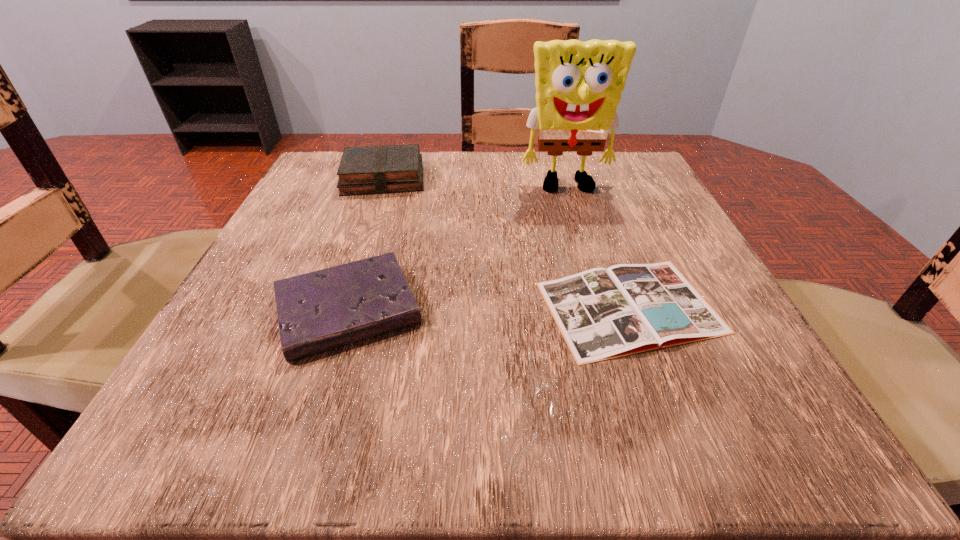
In order to click on free spot that satisfies the following two spatial constraints: 1. on the face of the tallest object; 2. on the right side of the shortest object in this screenshot , I will do `click(604, 307)`.

This screenshot has height=540, width=960. I want to click on vacant area in the image that satisfies the following two spatial constraints: 1. on the front side of the second shortest object; 2. on the left side of the left book, so click(339, 309).